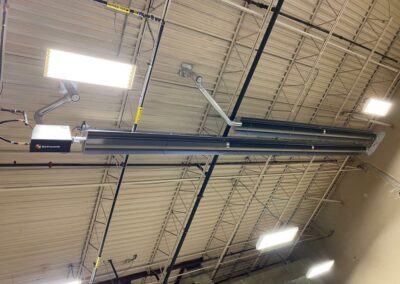
Identify the location of metal handle for light. (59, 100).